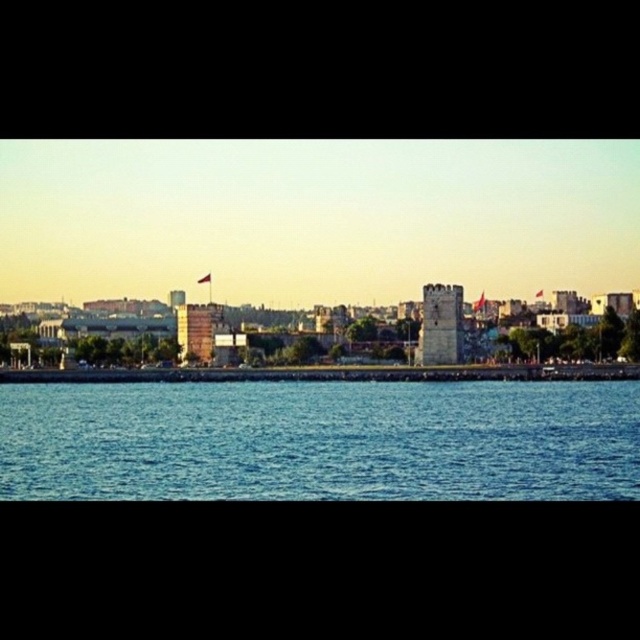
Question: Which object is closer to the camera taking this photo?

Choices:
 (A) blue liquid water at lower center
 (B) brick tower at center
 (C) stone tower at center

Answer: (A)

Question: Is stone tower at center smaller than brick tower at center?

Choices:
 (A) yes
 (B) no

Answer: (B)

Question: Considering the relative positions of blue liquid water at lower center and stone tower at center in the image provided, where is blue liquid water at lower center located with respect to stone tower at center?

Choices:
 (A) right
 (B) left

Answer: (B)

Question: Considering the real-world distances, which object is closest to the stone tower at center?

Choices:
 (A) brick tower at center
 (B) blue liquid water at lower center

Answer: (B)

Question: Does blue liquid water at lower center have a larger size compared to brick tower at center?

Choices:
 (A) no
 (B) yes

Answer: (B)

Question: Which of these objects is positioned farthest from the stone tower at center?

Choices:
 (A) brick tower at center
 (B) blue liquid water at lower center

Answer: (A)